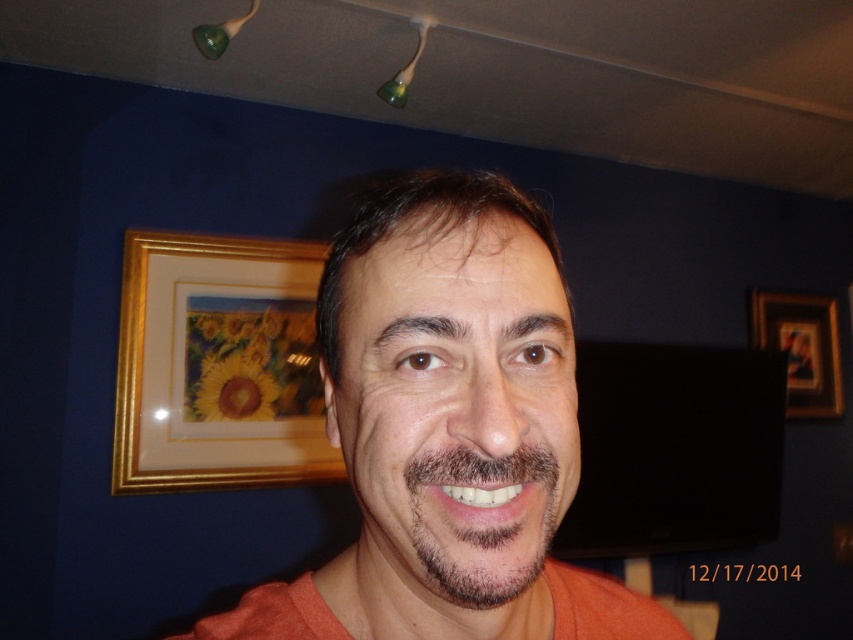
You are standing in a room with two ceiling spotlights. You want to place a new picture frame exactly halfway between the two spotlights. The coordinates of the spotlights are point A at (473, 534) and point B at 0.164, 0.445. What are the coordinates of the midpoint between them?

The midpoint between point A at (473, 534) and point B at 0.164, 0.445 is calculated by averaging their coordinates. The x coordinate is 0.836 and 0.164 divided by 2 equals 0.5. The y coordinate is 0.555 and 0.445 divided by 2 equals 0.5. So the midpoint is at 0.5, 0.5.

From the picture: Looking at the person in the image, which facial feature occupies a larger area on their face? The smooth skin face at center or the dark brown stubble at center?

The smooth skin face at center is much taller as dark brown stubble at center, so the smooth skin face at center occupies a larger area on their face.